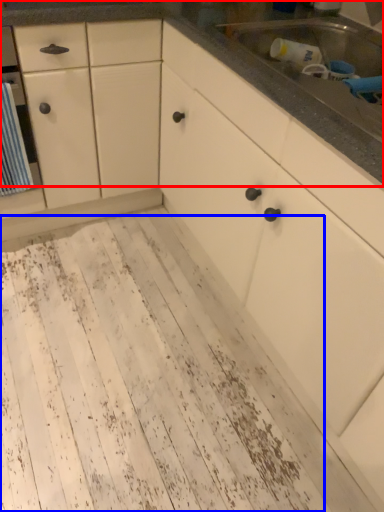
Question: Among these objects, which one is nearest to the camera, countertop (highlighted by a red box) or mud (highlighted by a blue box)?

Choices:
 (A) countertop
 (B) mud

Answer: (B)